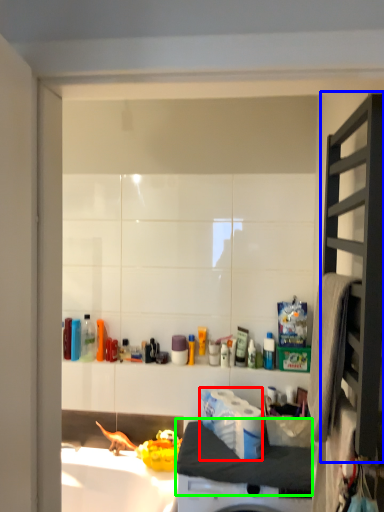
Question: Based on their relative distances, which object is farther from toilet paper (highlighted by a red box)? Choose from shelf (highlighted by a blue box) and counter top (highlighted by a green box).

Choices:
 (A) shelf
 (B) counter top

Answer: (A)